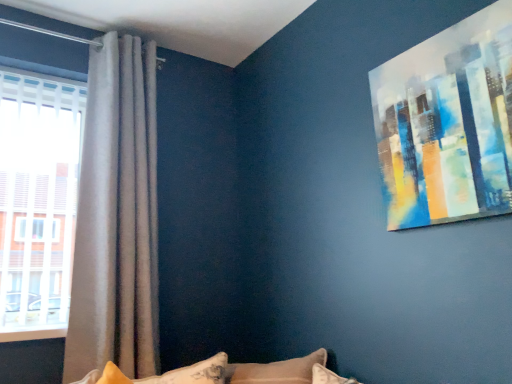
This screenshot has height=384, width=512. What are the coordinates of `fluffy white pillow at lower center` in the screenshot? It's located at (174, 373).

Measure the distance between acrylic painting at upper right and camera.

acrylic painting at upper right and camera are 1.17 meters apart from each other.

In order to click on satin grey curtain at left in this screenshot , I will do `click(117, 216)`.

Looking at the image, does satin grey curtain at left seem bigger or smaller compared to fluffy white pillow at lower center?

Considering their sizes, satin grey curtain at left takes up more space than fluffy white pillow at lower center.

Is fluffy white pillow at lower center at the back of satin grey curtain at left?

No, satin grey curtain at left is not facing away from fluffy white pillow at lower center.

Does satin grey curtain at left have a greater height compared to fluffy white pillow at lower center?

Yes.

Looking at this image, from the image's perspective, would you say satin grey curtain at left is shown under fluffy white pillow at lower center?

No.

Is satin grey curtain at left at the back of fluffy white pillow at lower center?

Yes, fluffy white pillow at lower center is facing away from satin grey curtain at left.

From the picture: From a real-world perspective, which is physically above, fluffy white pillow at lower center or satin grey curtain at left?

satin grey curtain at left is physically above.

Which of these two, fluffy white pillow at lower center or satin grey curtain at left, is thinner?

satin grey curtain at left is thinner.

From their relative heights in the image, would you say fluffy white pillow at lower center is taller or shorter than satin grey curtain at left?

fluffy white pillow at lower center is shorter than satin grey curtain at left.

Considering the sizes of objects satin grey curtain at left and acrylic painting at upper right in the image provided, who is taller, satin grey curtain at left or acrylic painting at upper right?

satin grey curtain at left is taller.

The image size is (512, 384). Find the location of `curtain located on the left of acrylic painting at upper right`. curtain located on the left of acrylic painting at upper right is located at coordinates (117, 216).

How many degrees apart are the facing directions of satin grey curtain at left and acrylic painting at upper right?

There is a 89.5-degree angle between the facing directions of satin grey curtain at left and acrylic painting at upper right.

Choose the correct answer: Is satin grey curtain at left inside acrylic painting at upper right or outside it?

satin grey curtain at left is outside acrylic painting at upper right.

Image resolution: width=512 pixels, height=384 pixels. I want to click on picture frame located above the fluffy white pillow at lower center (from a real-world perspective), so click(448, 123).

How much distance is there between fluffy white pillow at lower center and acrylic painting at upper right?

fluffy white pillow at lower center and acrylic painting at upper right are 3.91 feet apart from each other.

Does fluffy white pillow at lower center have a larger size compared to acrylic painting at upper right?

Yes.

Is fluffy white pillow at lower center beside acrylic painting at upper right?

No, fluffy white pillow at lower center is not next to acrylic painting at upper right.

From a real-world perspective, who is located lower, acrylic painting at upper right or satin grey curtain at left?

satin grey curtain at left is physically lower.

Visually, is acrylic painting at upper right positioned to the left or to the right of satin grey curtain at left?

acrylic painting at upper right is positioned on satin grey curtain at left's right side.

Is acrylic painting at upper right not within satin grey curtain at left?

Yes.

Which of these two, acrylic painting at upper right or fluffy white pillow at lower center, is bigger?

fluffy white pillow at lower center.

From a real-world perspective, which is physically below, acrylic painting at upper right or fluffy white pillow at lower center?

In real-world perspective, fluffy white pillow at lower center is lower.

Does acrylic painting at upper right appear on the left side of fluffy white pillow at lower center?

In fact, acrylic painting at upper right is to the right of fluffy white pillow at lower center.

Is acrylic painting at upper right facing away from fluffy white pillow at lower center?

No, fluffy white pillow at lower center is not at the back of acrylic painting at upper right.

In the image, there is a satin grey curtain at left. At what (x,y) coordinates should I click in order to perform the action: click on pillow below it (from a real-world perspective). Please return your answer as a coordinate pair (x, y). The image size is (512, 384). Looking at the image, I should click on pos(174,373).

Find the location of a particular element. This screenshot has width=512, height=384. pillow on the right of satin grey curtain at left is located at coordinates (174, 373).

From the picture: Which object lies further to the anchor point satin grey curtain at left, acrylic painting at upper right or fluffy white pillow at lower center?

acrylic painting at upper right is positioned further to the anchor satin grey curtain at left.

Based on their spatial positions, is satin grey curtain at left or fluffy white pillow at lower center further from acrylic painting at upper right?

Based on the image, satin grey curtain at left appears to be further to acrylic painting at upper right.

From the image, which object appears to be nearer to satin grey curtain at left, fluffy white pillow at lower center or acrylic painting at upper right?

Among the two, fluffy white pillow at lower center is located nearer to satin grey curtain at left.

Estimate the real-world distances between objects in this image. Which object is closer to fluffy white pillow at lower center, satin grey curtain at left or acrylic painting at upper right?

Among the two, satin grey curtain at left is located nearer to fluffy white pillow at lower center.

When comparing their distances from acrylic painting at upper right, does fluffy white pillow at lower center or satin grey curtain at left seem closer?

fluffy white pillow at lower center.

Considering their positions, is acrylic painting at upper right positioned closer to fluffy white pillow at lower center than satin grey curtain at left?

satin grey curtain at left is closer to fluffy white pillow at lower center.

Locate an element on the screen. The width and height of the screenshot is (512, 384). pillow between satin grey curtain at left and acrylic painting at upper right from left to right is located at coordinates (174, 373).